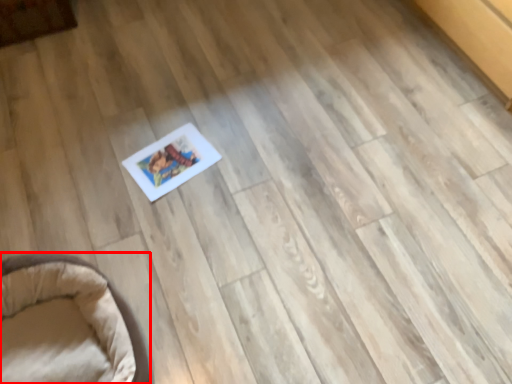
Question: Where is furniture (annotated by the red box) located in relation to furniture in the image?

Choices:
 (A) left
 (B) right

Answer: (B)